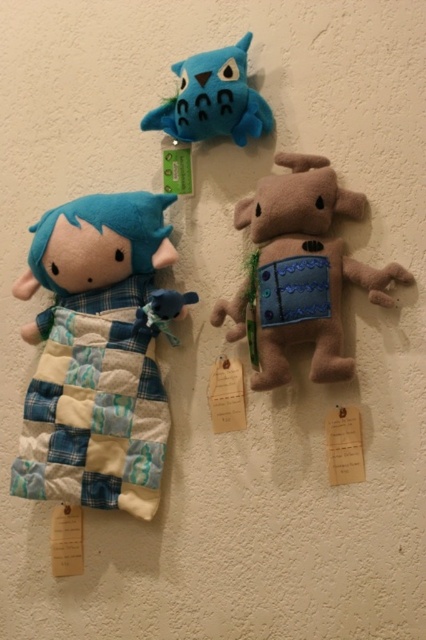
You are a toy collector who wants to display the patchwork fabric doll at left and the brown plush dog at center on a shelf. Which toy will occupy more vertical space on the shelf?

The patchwork fabric doll at left has a greater height compared to the brown plush dog at center, so it will occupy more vertical space on the shelf.

Looking at this image, you are organizing a display of the three plush toys. The brown plush dog at center and the matte blue plush owl at upper center are already placed. Where should you position the third toy to maintain symmetry in the display?

To maintain symmetry, the third toy should be placed to the left of the matte blue plush owl at upper center, mirroring the position of the brown plush dog at center.